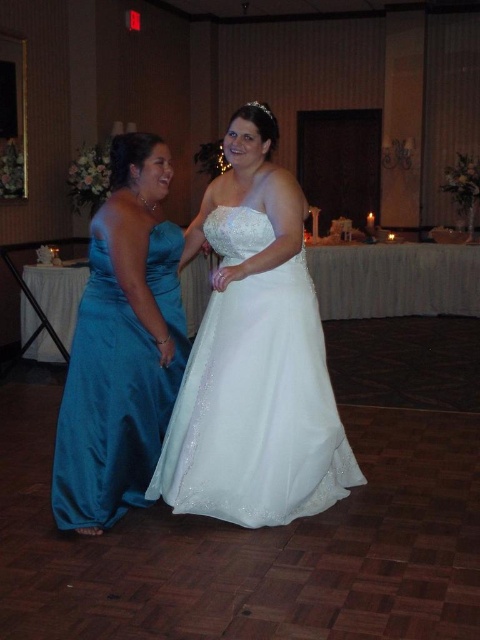
Can you confirm if white satin dress at center is positioned above teal satin dress at left?

Indeed, white satin dress at center is positioned over teal satin dress at left.

Is the position of white satin dress at center less distant than that of teal satin dress at left?

Yes, white satin dress at center is in front of teal satin dress at left.

Does point (235, 326) lie behind point (84, 310)?

Yes.

Where is `white satin dress at center`? This screenshot has height=640, width=480. white satin dress at center is located at coordinates (254, 355).